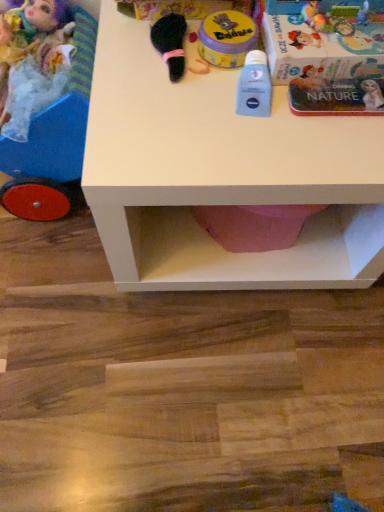
Where is `blank space above white matte table at center (from a real-world perspective)`? The height and width of the screenshot is (512, 384). blank space above white matte table at center (from a real-world perspective) is located at coordinates (227, 86).